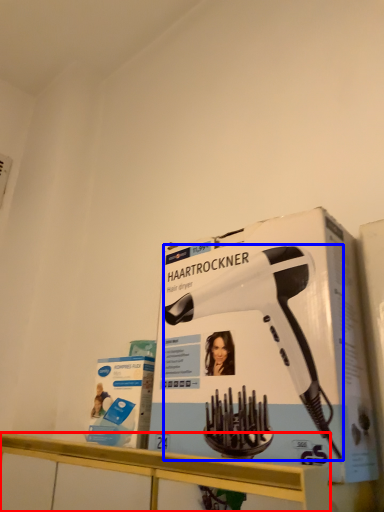
Question: Among these objects, which one is farthest to the camera, counter (highlighted by a red box) or hair drier (highlighted by a blue box)?

Choices:
 (A) counter
 (B) hair drier

Answer: (B)